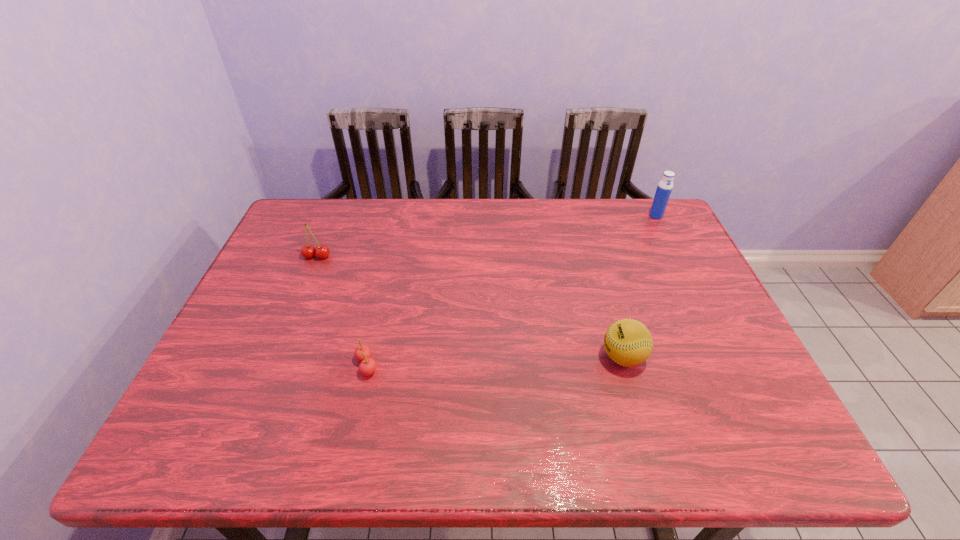
Where is `the farthest object`? The width and height of the screenshot is (960, 540). the farthest object is located at coordinates (664, 188).

Where is `the tallest object`? the tallest object is located at coordinates (664, 188).

Where is `the left cherry`? The image size is (960, 540). the left cherry is located at coordinates (308, 251).

Where is `the farther cherry`? The width and height of the screenshot is (960, 540). the farther cherry is located at coordinates (308, 251).

Where is `the third object from left to right`? the third object from left to right is located at coordinates coord(628,342).

Locate an element on the screen. the shortest object is located at coordinates (362, 353).

What are the coordinates of `the nearer cherry` in the screenshot? It's located at (362, 353).

Where is `free space located on the left of the water bottle`? This screenshot has width=960, height=540. free space located on the left of the water bottle is located at coordinates (628, 216).

What are the coordinates of `vacant space located 0.270m with the stems of the left cherry pointing upwards` in the screenshot? It's located at (286, 332).

I want to click on vacant space located on the logo side of the second object from right to left, so click(567, 357).